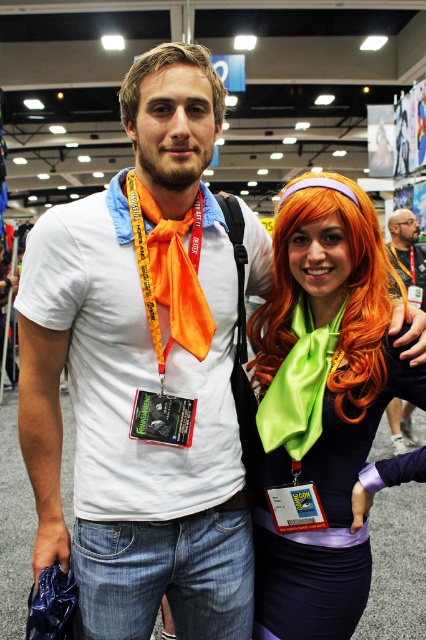
Measure the distance from orange fabric lanyard at center to green satin lanyard at center.

orange fabric lanyard at center is 12.06 inches from green satin lanyard at center.

Who is more forward, [193,300] or [275,428]?

Point [193,300] is more forward.

Locate an element on the screen. Image resolution: width=426 pixels, height=640 pixels. orange fabric lanyard at center is located at coordinates (169, 273).

Does green satin lanyard at center appear on the left side of matte orange scarf at center?

Indeed, green satin lanyard at center is positioned on the left side of matte orange scarf at center.

Who is more forward, (307,352) or (397,444)?

Point (307,352)

You are a GUI agent. You are given a task and a screenshot of the screen. Output one action in this format:
    pyautogui.click(x=<x>, y=<y>)
    Task: Click on the green satin lanyard at center
    This screenshot has height=640, width=426.
    Given the screenshot: What is the action you would take?
    pyautogui.click(x=299, y=385)

This screenshot has height=640, width=426. Identify the location of green satin lanyard at center. (299, 385).

Which of these two, orange silky wig at center or orange fabric lanyard at center, stands taller?

With more height is orange silky wig at center.

Is orange silky wig at center above orange fabric lanyard at center?

No, orange silky wig at center is not above orange fabric lanyard at center.

The width and height of the screenshot is (426, 640). I want to click on orange silky wig at center, so click(347, 300).